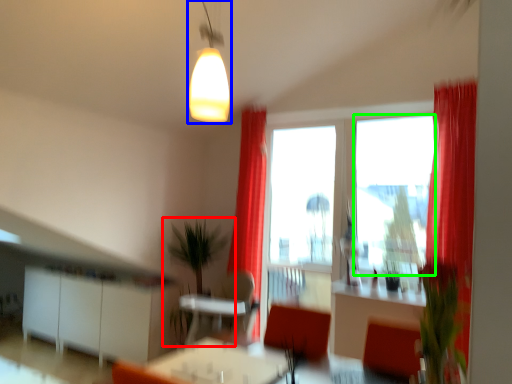
Question: Which is farther away from houseplant (highlighted by a red box)? light fixture (highlighted by a blue box) or window screen (highlighted by a green box)?

Choices:
 (A) light fixture
 (B) window screen

Answer: (A)